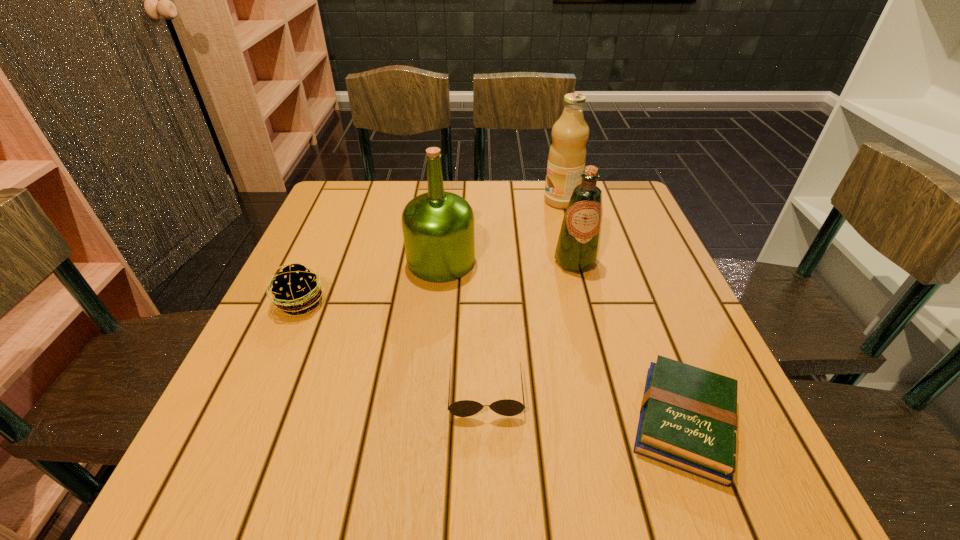
The image size is (960, 540). In order to click on vacant space that satisfies the following two spatial constraints: 1. on the label of the farthest object; 2. on the front-facing side of the fourth shortest object in this screenshot , I will do `click(577, 261)`.

The width and height of the screenshot is (960, 540). Identify the location of free space that satisfies the following two spatial constraints: 1. on the label of the farthest object; 2. on the back side of the book. (619, 422).

Where is `vacant space that satisfies the following two spatial constraints: 1. on the front-facing side of the shortest olive oil; 2. on the right side of the book`? This screenshot has height=540, width=960. vacant space that satisfies the following two spatial constraints: 1. on the front-facing side of the shortest olive oil; 2. on the right side of the book is located at coordinates (616, 422).